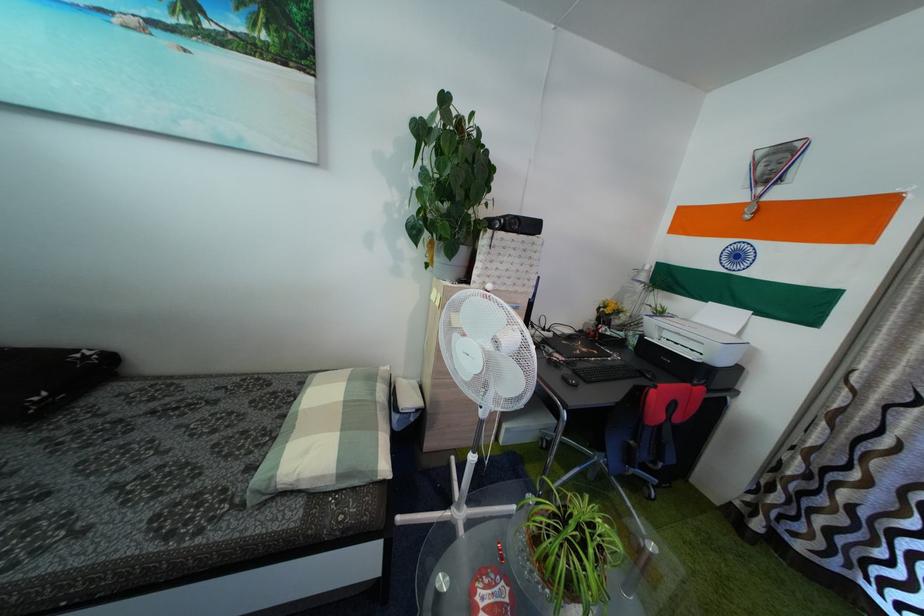
Where is `white printer lid`? This screenshot has height=616, width=924. white printer lid is located at coordinates (685, 330).